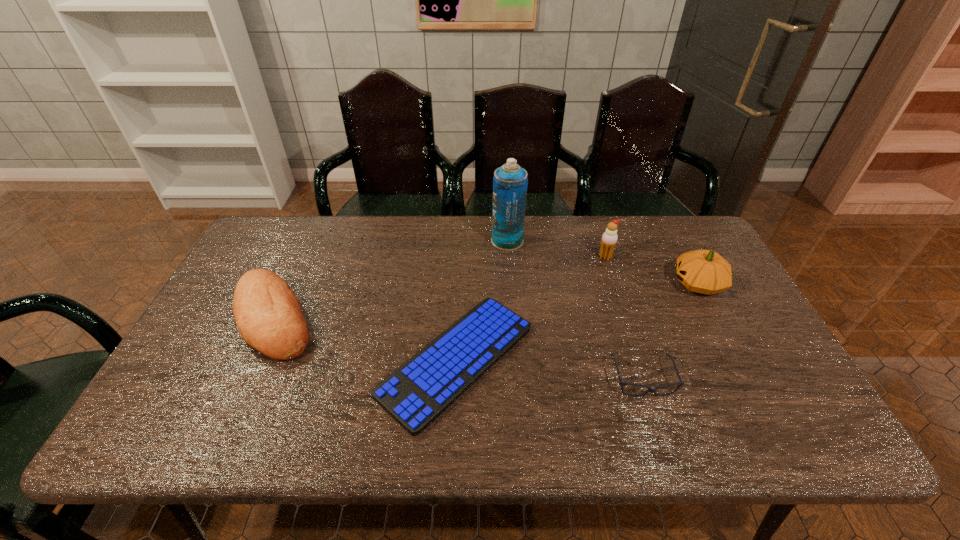
This screenshot has height=540, width=960. Find the location of `object present at the left edge`. object present at the left edge is located at coordinates (269, 317).

The image size is (960, 540). In order to click on object situated at the right edge in this screenshot , I will do `click(703, 271)`.

Locate an element on the screen. This screenshot has width=960, height=540. vacant space at the far edge of the desktop is located at coordinates (316, 247).

The height and width of the screenshot is (540, 960). In the image, there is a desktop. In order to click on blank space at the near edge in this screenshot , I will do `click(714, 427)`.

Image resolution: width=960 pixels, height=540 pixels. In the image, there is a desktop. Identify the location of vacant region at the right edge. click(764, 364).

Locate an element on the screen. This screenshot has width=960, height=540. free space at the far right corner is located at coordinates (684, 239).

At what (x,y) coordinates should I click in order to perform the action: click on empty location between the computer keyboard and the spectacles. Please return your answer as a coordinate pair (x, y). Looking at the image, I should click on (549, 369).

Where is `vacant space in between the aerosol can and the gourd`? The image size is (960, 540). vacant space in between the aerosol can and the gourd is located at coordinates (603, 262).

Where is `unoccupied position between the tallest object and the third shortest object`? unoccupied position between the tallest object and the third shortest object is located at coordinates (391, 280).

I want to click on free spot between the fifth nearest object and the computer keyboard, so (x=531, y=308).